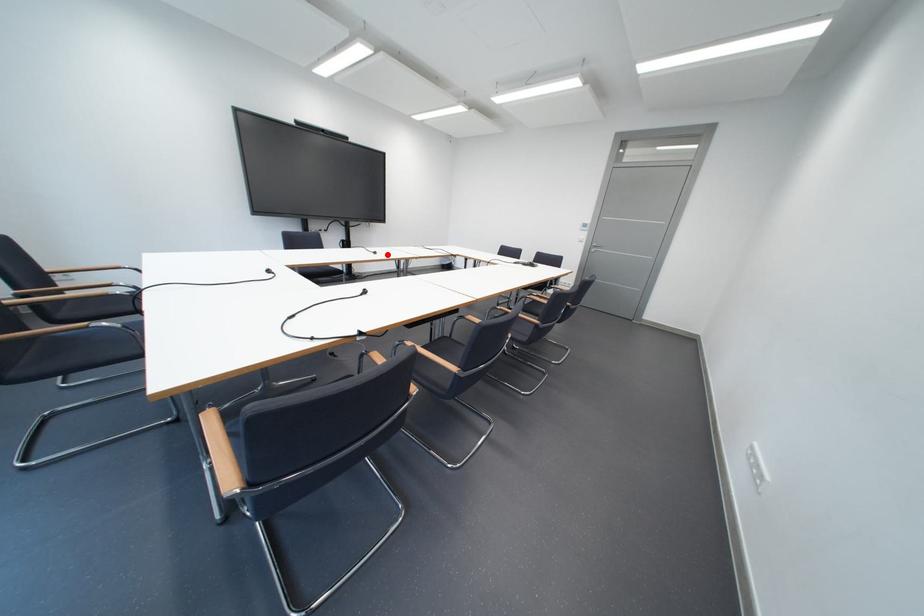
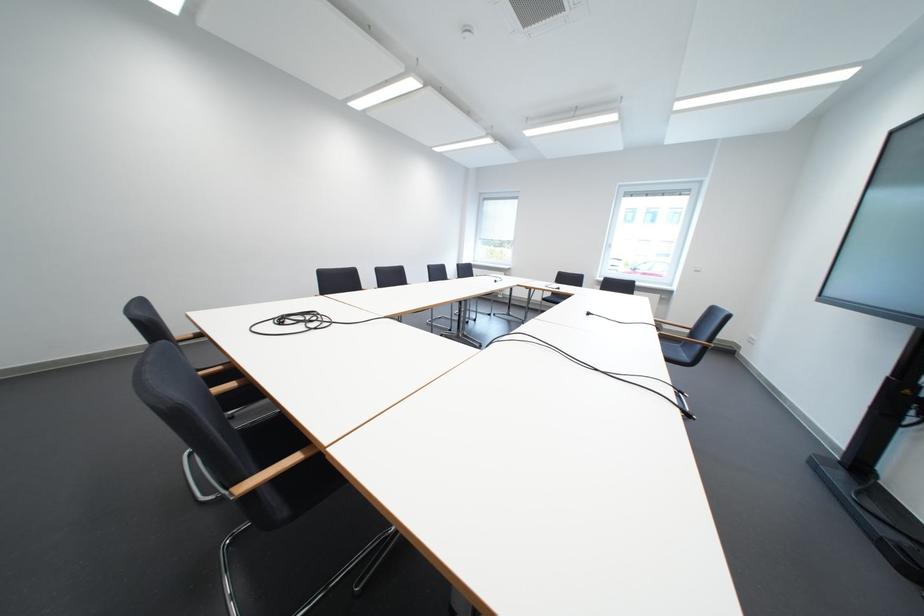
Question: I am providing you with two images of the same scene from different viewpoints. Given a red point in image1, look at the same physical point in image2. Is it:

Choices:
 (A) Closer to the viewpoint
 (B) Farther from the viewpoint

Answer: (B)